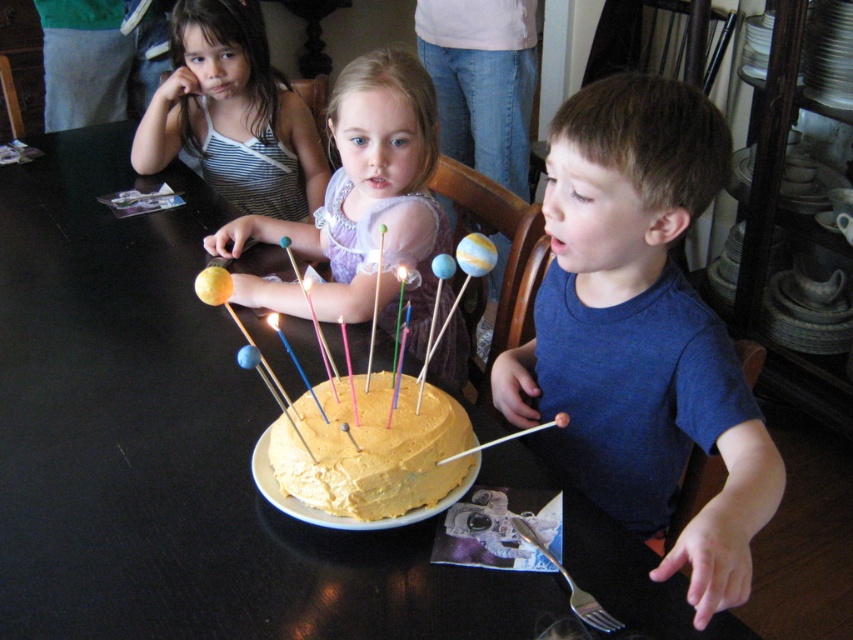
Does black glossy table at center appear on the left side of matte purple dress at center?

Correct, you'll find black glossy table at center to the left of matte purple dress at center.

Can you confirm if black glossy table at center is thinner than matte purple dress at center?

No, black glossy table at center is not thinner than matte purple dress at center.

Does point (260, 588) come behind point (334, 316)?

No, it is in front of (334, 316).

In order to click on black glossy table at center in this screenshot , I will do `click(172, 445)`.

Can you confirm if blue cotton shirt at center is positioned to the left of yellow frosted cake at center?

No, blue cotton shirt at center is not to the left of yellow frosted cake at center.

Identify the location of blue cotton shirt at center. The image size is (853, 640). (641, 332).

You are a GUI agent. You are given a task and a screenshot of the screen. Output one action in this format:
    pyautogui.click(x=<x>, y=<y>)
    Task: Click on the blue cotton shirt at center
    
    Given the screenshot: What is the action you would take?
    pyautogui.click(x=641, y=332)

From the picture: Which of these two, blue cotton shirt at center or striped fabric dress at upper left, stands shorter?

striped fabric dress at upper left

I want to click on blue cotton shirt at center, so click(x=641, y=332).

Where is `blue cotton shirt at center`? blue cotton shirt at center is located at coordinates (641, 332).